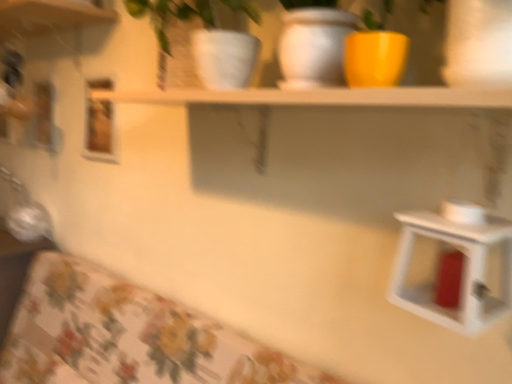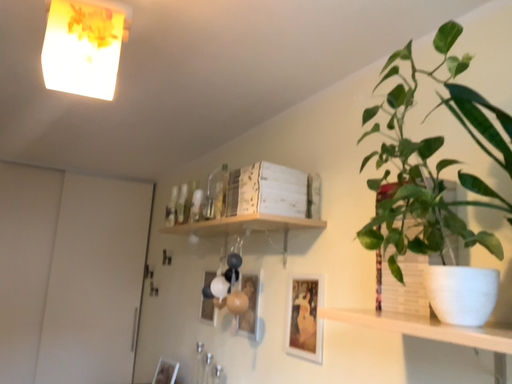
Question: Which way did the camera rotate in the video?

Choices:
 (A) rotated upward
 (B) rotated downward

Answer: (A)